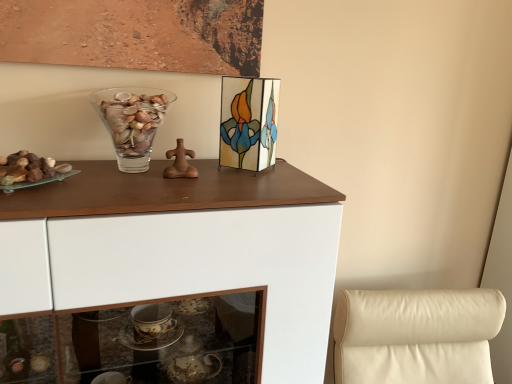
Question: Does white glossy cabinet at upper center have a greater height compared to stained glass picture frame at upper center?

Choices:
 (A) yes
 (B) no

Answer: (A)

Question: Can you confirm if white glossy cabinet at upper center is smaller than stained glass picture frame at upper center?

Choices:
 (A) no
 (B) yes

Answer: (A)

Question: Considering the relative sizes of white glossy cabinet at upper center and stained glass picture frame at upper center in the image provided, is white glossy cabinet at upper center shorter than stained glass picture frame at upper center?

Choices:
 (A) yes
 (B) no

Answer: (B)

Question: From the image's perspective, is white glossy cabinet at upper center under stained glass picture frame at upper center?

Choices:
 (A) yes
 (B) no

Answer: (A)

Question: Is white glossy cabinet at upper center positioned before stained glass picture frame at upper center?

Choices:
 (A) no
 (B) yes

Answer: (B)

Question: From a real-world perspective, is white glossy cabinet at upper center over stained glass picture frame at upper center?

Choices:
 (A) yes
 (B) no

Answer: (B)

Question: From a real-world perspective, does translucent glass rocks at left sit lower than white glossy cabinet at upper center?

Choices:
 (A) no
 (B) yes

Answer: (A)

Question: Is translucent glass rocks at left shorter than white glossy cabinet at upper center?

Choices:
 (A) no
 (B) yes

Answer: (B)

Question: Is translucent glass rocks at left far from white glossy cabinet at upper center?

Choices:
 (A) yes
 (B) no

Answer: (B)

Question: Does translucent glass rocks at left appear on the left side of white glossy cabinet at upper center?

Choices:
 (A) no
 (B) yes

Answer: (B)

Question: Is translucent glass rocks at left taller than white glossy cabinet at upper center?

Choices:
 (A) yes
 (B) no

Answer: (B)

Question: Does translucent glass rocks at left have a lesser width compared to white glossy cabinet at upper center?

Choices:
 (A) no
 (B) yes

Answer: (B)

Question: Does translucent glass rocks at left come behind transparent glass vase at upper center?

Choices:
 (A) no
 (B) yes

Answer: (A)